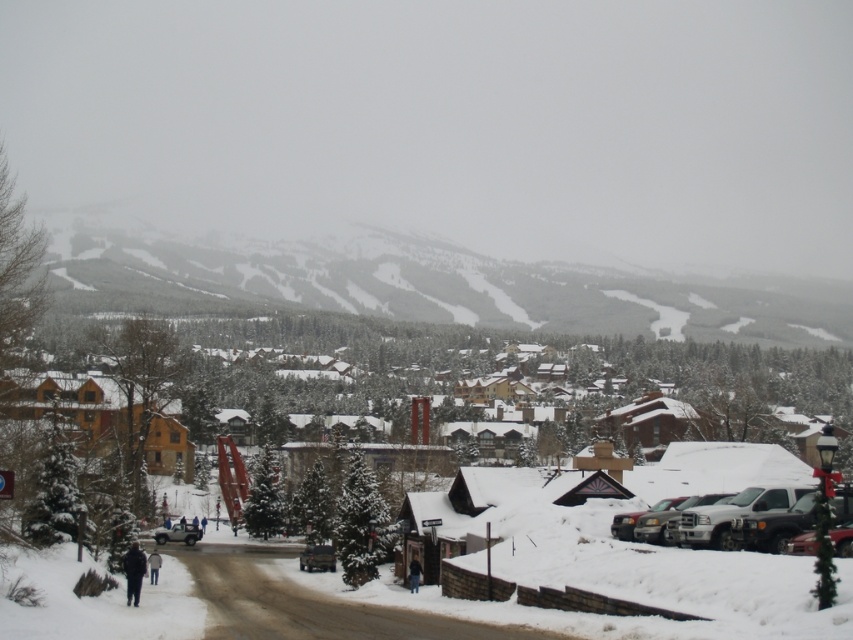
You are standing at the snow covered road in the foreground of the mountain town scene. You see two points marked in the image, point 1 at coordinates point (728, 541) and point 2 at coordinates point (190, 524). Which point is closer to you?

Point (728, 541) is closer to the viewer than point (190, 524).

You are a delivery driver who needs to park your vehicle in this winter scene. You have a metallic silver truck at lower right and a metallic silver car at center. Which vehicle should you choose if you want to park in a space that can accommodate a larger vehicle?

The metallic silver truck at lower right is larger than the metallic silver car at center, so you should choose the metallic silver truck at lower right for the larger parking space.

You are a delivery driver who needs to park your vehicle in a narrow parking spot that can only accommodate vehicles up to 1.8 meters in width. You have a metallic silver car at center and a silver metallic suv at center available. Which vehicle should you choose to fit into the parking spot?

The metallic silver car at center is thinner than the silver metallic suv at center. Since the parking spot can only accommodate vehicles up to 1.8 meters in width, the metallic silver car at center is the better choice as it is narrower and more likely to fit within the space.